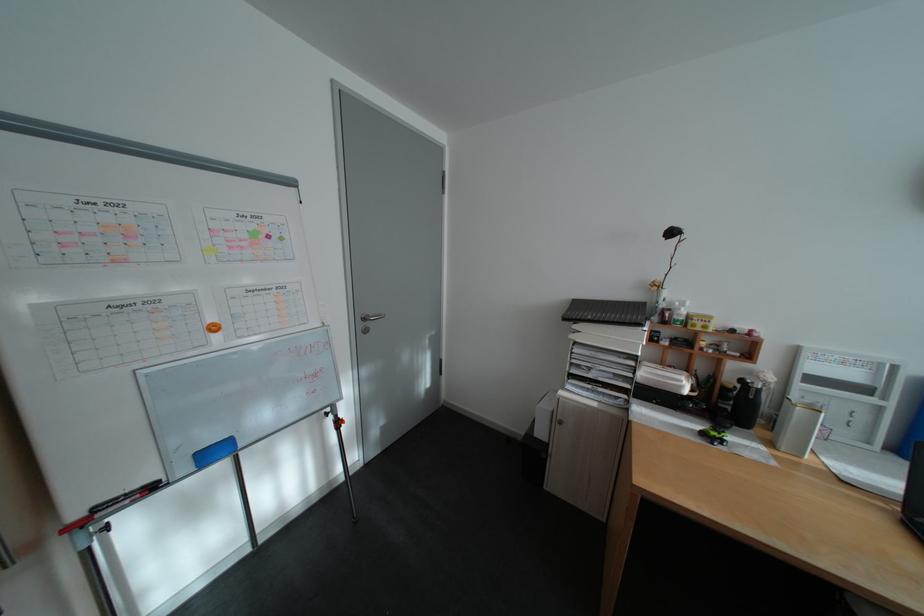
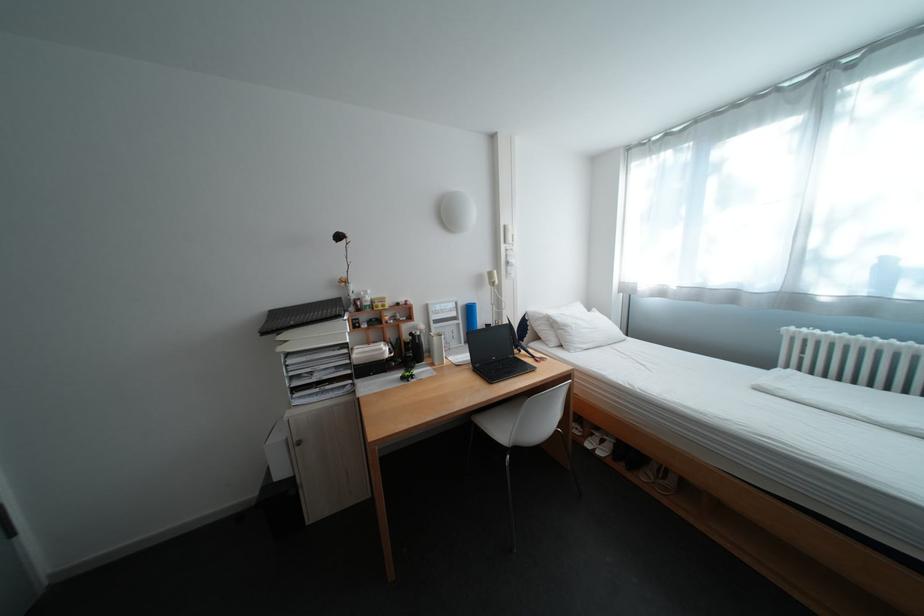
Question: The camera is either moving clockwise (left) or counter-clockwise (right) around the object. The first image is from the beginning of the video and the second image is from the end. Is the camera moving left or right when shooting the video?

Choices:
 (A) Left
 (B) Right

Answer: (A)